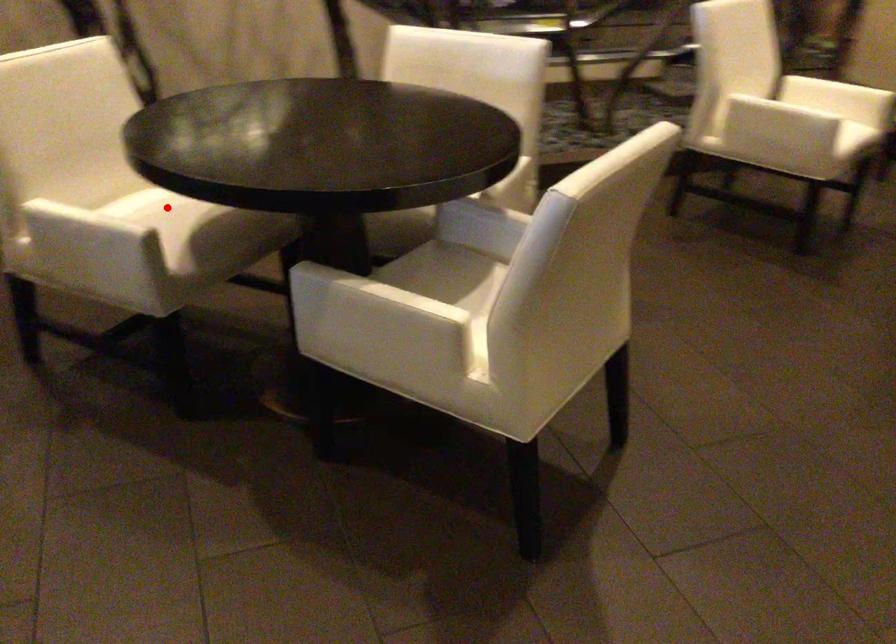
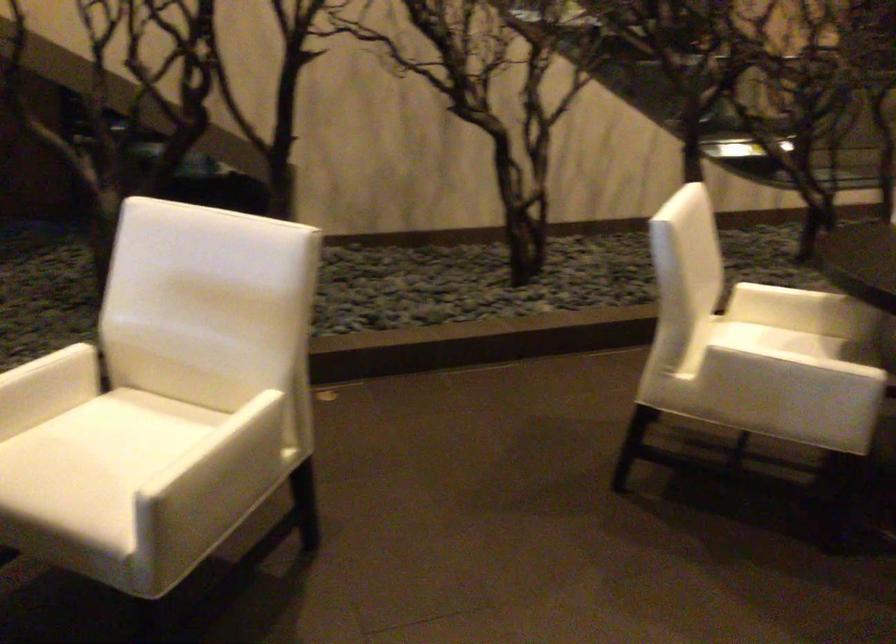
Question: I am providing you with two images of the same scene from different viewpoints. A red point is marked on the first image. At the location where the point appears in image 1, is it still visible in image 2?

Choices:
 (A) Yes
 (B) No

Answer: (A)